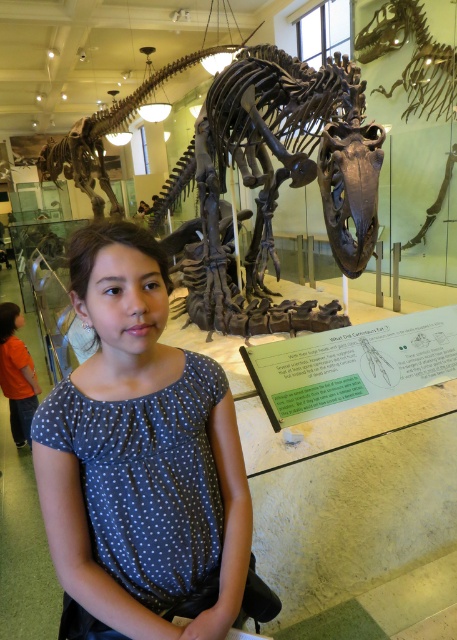
Is shiny metallic skull at upper right above orange shirt at left?

Correct, shiny metallic skull at upper right is located above orange shirt at left.

Is point (407, 116) farther from camera compared to point (0, 342)?

Yes.

Between point (414, 24) and point (35, 397), which one is positioned in front?

Positioned in front is point (35, 397).

The width and height of the screenshot is (457, 640). I want to click on shiny metallic skull at upper right, so click(x=412, y=58).

Can you confirm if shiny metallic dinosaur skeleton at center is wider than orange shirt at left?

Yes.

At what (x,y) coordinates should I click in order to perform the action: click on shiny metallic dinosaur skeleton at center. Please return your answer as a coordinate pair (x, y). The height and width of the screenshot is (640, 457). Looking at the image, I should click on (281, 163).

The width and height of the screenshot is (457, 640). What are the coordinates of `shiny metallic dinosaur skeleton at center` in the screenshot? It's located at (281, 163).

In the scene shown: Does shiny metallic dinosaur skeleton at center have a greater width compared to shiny metallic skull at upper right?

Yes, shiny metallic dinosaur skeleton at center is wider than shiny metallic skull at upper right.

What do you see at coordinates (281, 163) in the screenshot? This screenshot has width=457, height=640. I see `shiny metallic dinosaur skeleton at center` at bounding box center [281, 163].

The height and width of the screenshot is (640, 457). I want to click on shiny metallic dinosaur skeleton at center, so click(281, 163).